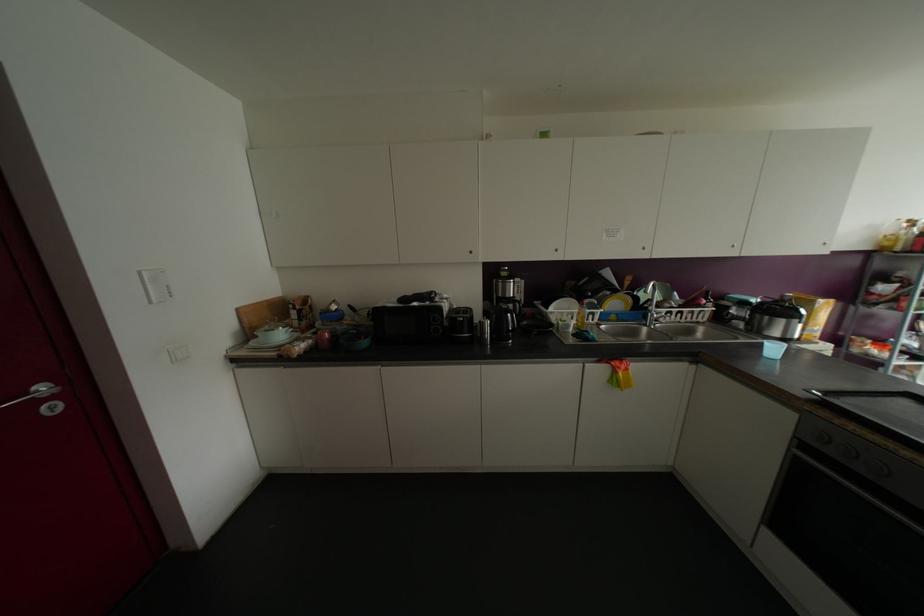
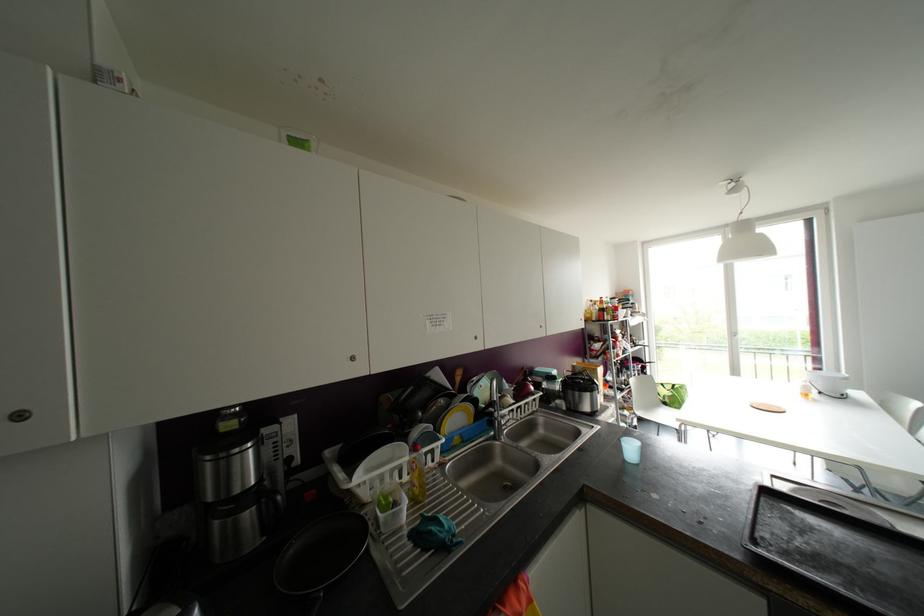
Locate, in the second image, the point that corresponds to [555,249] in the first image.

(351, 358)